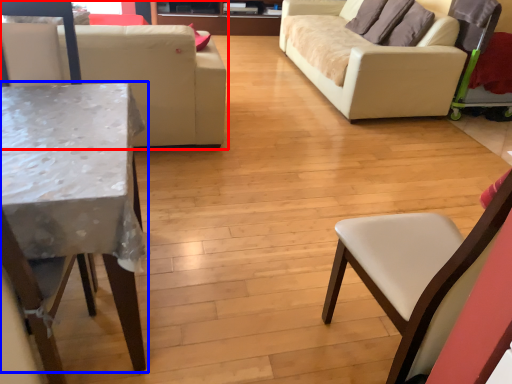
Question: Which object appears closest to the camera in this image, studio couch (highlighted by a red box) or table (highlighted by a blue box)?

Choices:
 (A) studio couch
 (B) table

Answer: (B)